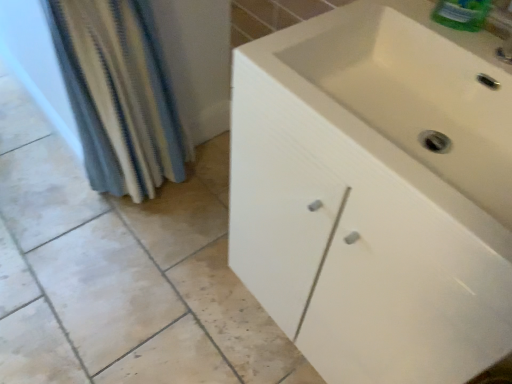
Question: Considering the relative positions of white matte cabinet at center and blue striped fabric at left in the image provided, is white matte cabinet at center to the left of blue striped fabric at left from the viewer's perspective?

Choices:
 (A) no
 (B) yes

Answer: (A)

Question: From a real-world perspective, is white matte cabinet at center below blue striped fabric at left?

Choices:
 (A) no
 (B) yes

Answer: (B)

Question: From the image's perspective, is white matte cabinet at center on top of blue striped fabric at left?

Choices:
 (A) no
 (B) yes

Answer: (A)

Question: Is white matte cabinet at center to the right of blue striped fabric at left from the viewer's perspective?

Choices:
 (A) no
 (B) yes

Answer: (B)

Question: Can you see white matte cabinet at center touching blue striped fabric at left?

Choices:
 (A) yes
 (B) no

Answer: (B)

Question: Can you confirm if white matte cabinet at center is smaller than blue striped fabric at left?

Choices:
 (A) no
 (B) yes

Answer: (A)

Question: Would you say blue striped fabric at left is a long distance from white matte cabinet at center?

Choices:
 (A) no
 (B) yes

Answer: (A)

Question: Considering the relative positions of blue striped fabric at left and white matte cabinet at center in the image provided, is blue striped fabric at left in front of white matte cabinet at center?

Choices:
 (A) yes
 (B) no

Answer: (B)

Question: Is blue striped fabric at left directly adjacent to white matte cabinet at center?

Choices:
 (A) no
 (B) yes

Answer: (A)

Question: Considering the relative sizes of blue striped fabric at left and white matte cabinet at center in the image provided, is blue striped fabric at left smaller than white matte cabinet at center?

Choices:
 (A) yes
 (B) no

Answer: (A)

Question: From the image's perspective, is blue striped fabric at left on white matte cabinet at center?

Choices:
 (A) no
 (B) yes

Answer: (B)

Question: Is blue striped fabric at left facing towards white matte cabinet at center?

Choices:
 (A) no
 (B) yes

Answer: (B)

Question: Is blue striped fabric at left wider or thinner than white matte cabinet at center?

Choices:
 (A) wide
 (B) thin

Answer: (B)